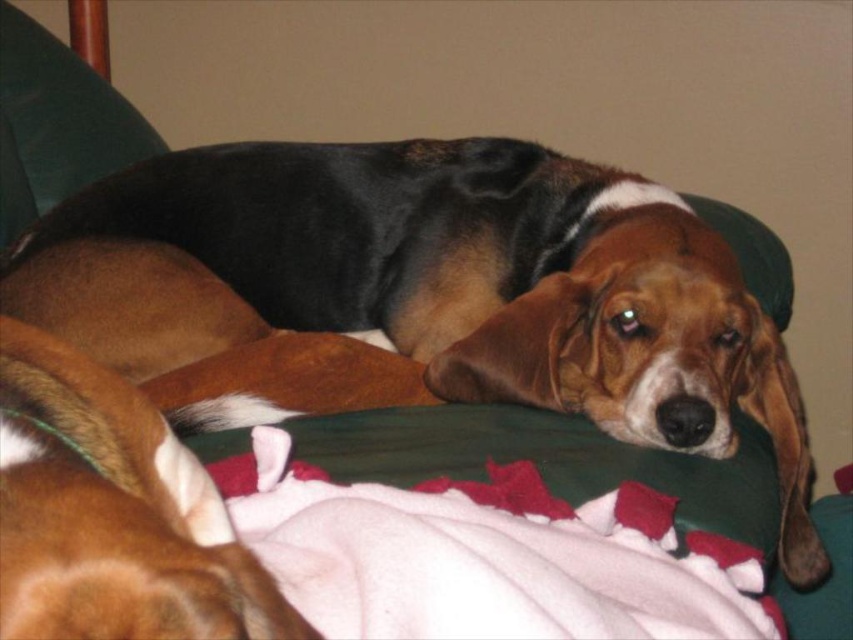
Consider the image. You are a photographer trying to capture a closeup shot of the brown fur dog at center. Based on its 2D coordinates, where should you position your camera to ensure the dog is centered in the frame?

The brown fur dog at center is located at coordinates approximately 0.463 on the x axis and 0.491 on the y axis. To center the dog in the frame, the camera should be positioned so that the center of the frame aligns with these coordinates.

You are a pet owner who wants to place a new toy between the white fleece blanket at center and the brown furry dog at center. The toy is 8 inches long. Do you think the space between them is sufficient to fit the toy?

The space between the white fleece blanket at center and the brown furry dog at center is 7.77 inches. Since the toy is 8 inches long, it will not fit in the available space.

You are trying to decide whether to place a new small pillow on the couch. The couch currently has a white fleece blanket at center and a brown furry dog at center. Based on their sizes, can the pillow fit between them?

The white fleece blanket at center is larger in size than the brown furry dog at center. Since the pillow is small, there might be enough space between them for it to fit.